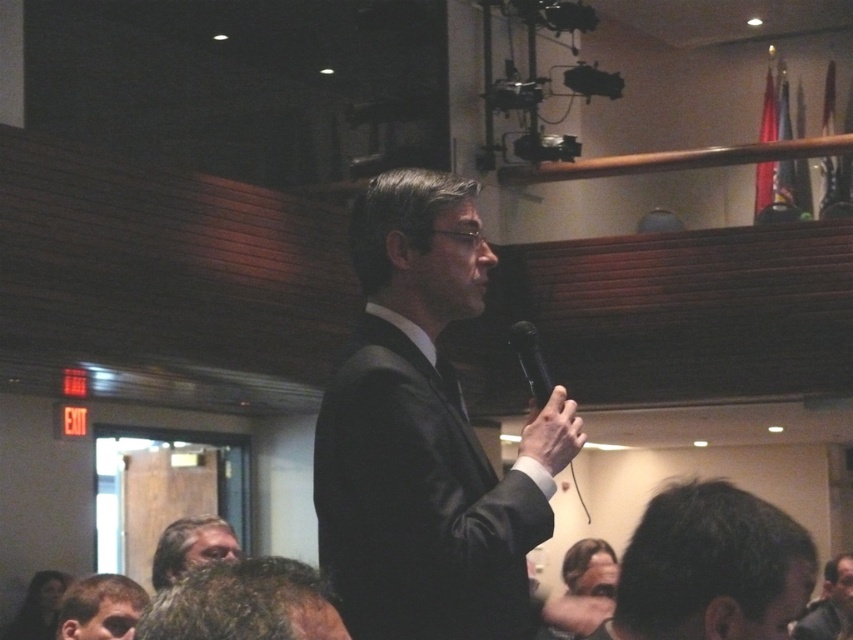
Find the location of a particular element. The image size is (853, 640). dark brown hair at lower right is located at coordinates pyautogui.click(x=711, y=566).

Is point (712, 483) closer to camera compared to point (535, 387)?

That is True.

The height and width of the screenshot is (640, 853). Describe the element at coordinates (711, 566) in the screenshot. I see `dark brown hair at lower right` at that location.

At what (x,y) coordinates should I click in order to perform the action: click on dark brown hair at lower right. Please return your answer as a coordinate pair (x, y). Image resolution: width=853 pixels, height=640 pixels. Looking at the image, I should click on pos(711,566).

Can you confirm if dark brown hair at lower right is wider than smooth skin hand at center?

Yes, dark brown hair at lower right is wider than smooth skin hand at center.

In order to click on dark brown hair at lower right in this screenshot , I will do `click(711, 566)`.

Find the location of a particular element. The image size is (853, 640). smooth skin hand at center is located at coordinates (552, 433).

Does point (561, 442) come behind point (836, 609)?

No, it is in front of (836, 609).

Find the location of a particular element. smooth skin hand at center is located at coordinates (552, 433).